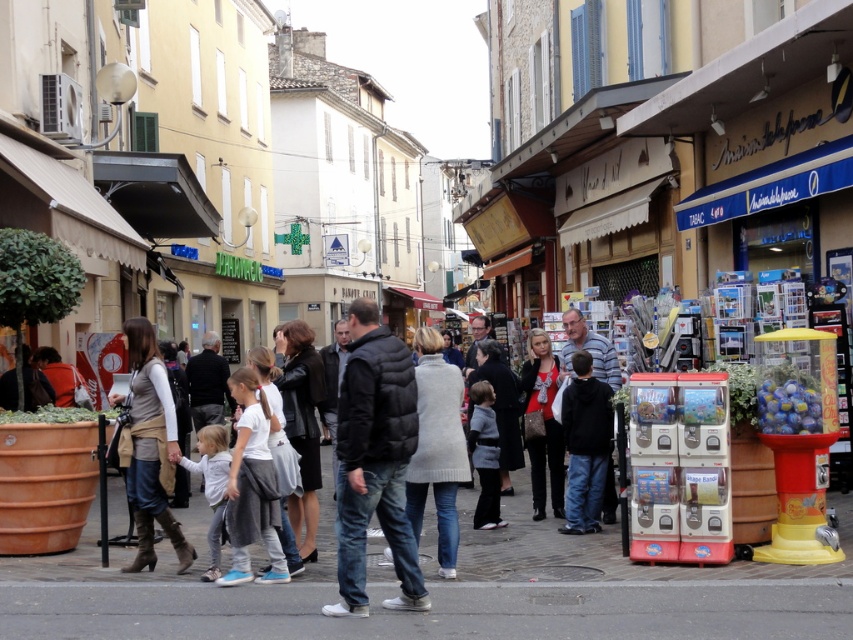
Question: Does white matte shirt at center lie in front of gray wool sweater at center?

Choices:
 (A) no
 (B) yes

Answer: (B)

Question: Which point is closer to the camera?

Choices:
 (A) (231, 496)
 (B) (526, 412)
 (C) (491, 474)

Answer: (A)

Question: Which object is closer to the camera taking this photo?

Choices:
 (A) gray wool sweater at center
 (B) black puffy jacket at center
 (C) light brown leather jacket at center
 (D) white matte shirt at center

Answer: (B)

Question: Which object appears farthest from the camera in this image?

Choices:
 (A) matte black dress at center
 (B) black matte jacket at center
 (C) black puffy jacket at center
 (D) gray wool sweater at center

Answer: (A)

Question: Where is black puffy jacket at center located in relation to light brown leather jacket at center in the image?

Choices:
 (A) right
 (B) left

Answer: (A)

Question: Does black puffy jacket at center appear over black matte jacket at center?

Choices:
 (A) no
 (B) yes

Answer: (B)